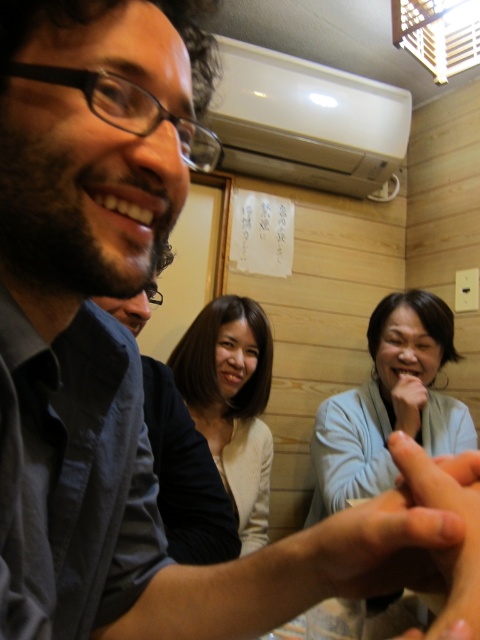
You are standing in the room and want to hand a gift to the person wearing the smooth beige blouse at center. If you can reach up to 1.5 meters, will you be able to reach them?

The smooth beige blouse at center is 1.45 meters away from the viewer, so yes, you can reach them since your reach is 1.5 meters.

You are a fashion designer observing the image. You notice the light blue fabric at center and the smooth beige blouse at center. Which one appears to have a greater width in the scene?

The light blue fabric at center might be wider than smooth beige blouse at center according to the description.

You are a photographer trying to capture a candid shot of the scene. You notice the smooth beige blouse at center and the smooth skin hand at center. Which object is positioned lower in the frame?

The smooth beige blouse at center is located below the smooth skin hand at center, so the smooth beige blouse at center is positioned lower in the frame.